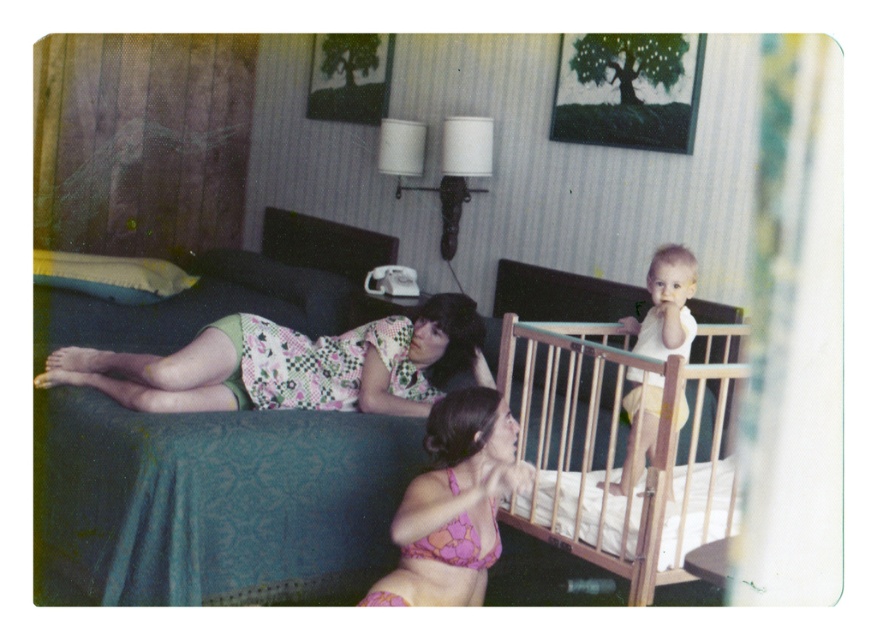
Question: Is wooden crib at lower center thinner than floral fabric dress at upper left?

Choices:
 (A) yes
 (B) no

Answer: (A)

Question: Which object is farther from the camera taking this photo?

Choices:
 (A) pink floral bikini top at lower center
 (B) floral fabric dress at upper left

Answer: (B)

Question: Which point appears farthest from the camera in this image?

Choices:
 (A) (418, 310)
 (B) (138, 413)
 (C) (675, 388)

Answer: (A)

Question: Is pink floral bikini top at lower center thinner than white matte baby at center?

Choices:
 (A) yes
 (B) no

Answer: (B)

Question: Is floral fabric dress at upper left positioned before white matte baby at center?

Choices:
 (A) no
 (B) yes

Answer: (A)

Question: Which object is positioned farthest from the pink floral bikini top at lower center?

Choices:
 (A) floral fabric dress at upper left
 (B) wooden crib at lower center
 (C) white matte baby at center

Answer: (A)